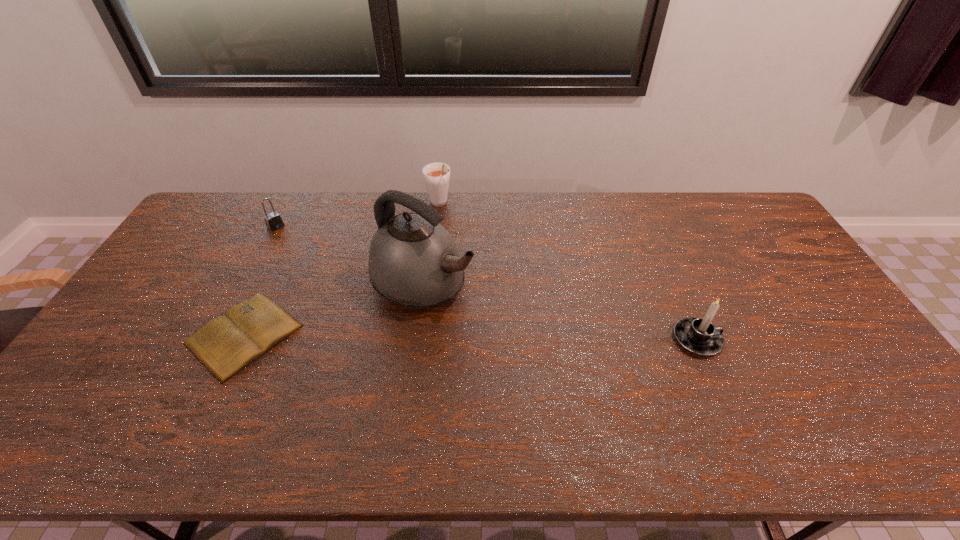
You are a GUI agent. You are given a task and a screenshot of the screen. Output one action in this format:
    pyautogui.click(x=<x>, y=<y>)
    Task: Click on the free space located at the spout of the kettle
    This screenshot has height=540, width=960.
    Given the screenshot: What is the action you would take?
    pyautogui.click(x=502, y=321)

Image resolution: width=960 pixels, height=540 pixels. What are the coordinates of `free space located 0.250m on the drink side of the root beer` in the screenshot? It's located at (470, 254).

Where is `vacant space situated 0.250m on the drink side of the root beer`? The image size is (960, 540). vacant space situated 0.250m on the drink side of the root beer is located at coordinates (470, 254).

This screenshot has width=960, height=540. Find the location of `vacant space located 0.180m on the drink side of the root beer`. vacant space located 0.180m on the drink side of the root beer is located at coordinates (462, 241).

You are a GUI agent. You are given a task and a screenshot of the screen. Output one action in this format:
    pyautogui.click(x=<x>, y=<y>)
    Task: Click on the free point located 0.260m on the shackle of the second shortest object
    The image size is (960, 540).
    Given the screenshot: What is the action you would take?
    pyautogui.click(x=322, y=266)

You are a GUI agent. You are given a task and a screenshot of the screen. Output one action in this format:
    pyautogui.click(x=<x>, y=<y>)
    Task: Click on the free space located 0.360m on the shackle of the second shortest object
    The width and height of the screenshot is (960, 540).
    Given the screenshot: What is the action you would take?
    pyautogui.click(x=339, y=281)

Locate an element on the screen. This screenshot has width=960, height=540. vacant space situated 0.280m on the shackle of the second shortest object is located at coordinates (324, 269).

Where is `root beer that is at the far edge`? The image size is (960, 540). root beer that is at the far edge is located at coordinates (436, 175).

Image resolution: width=960 pixels, height=540 pixels. In order to click on padlock that is at the far edge in this screenshot , I will do point(273,221).

Locate an element on the screen. object at the near edge is located at coordinates (225, 345).